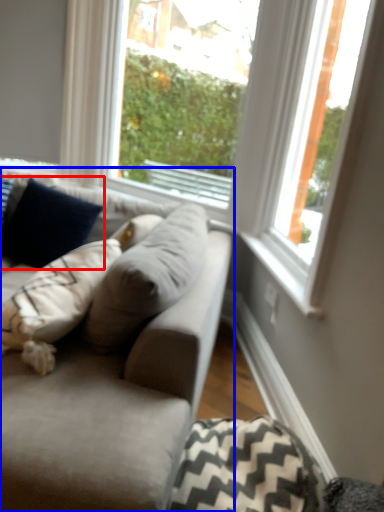
Question: Which of the following is the closest to the observer, pillow (highlighted by a red box) or studio couch (highlighted by a blue box)?

Choices:
 (A) pillow
 (B) studio couch

Answer: (B)